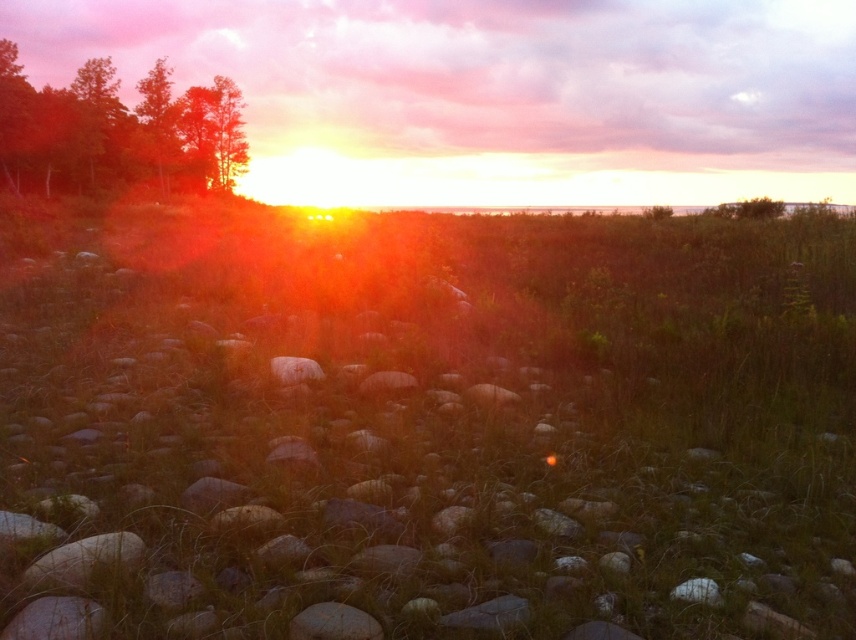
Question: Where is green grass at center located in relation to green matte trees at left in the image?

Choices:
 (A) right
 (B) left

Answer: (A)

Question: Among these objects, which one is nearest to the camera?

Choices:
 (A) green grass at center
 (B) green matte trees at left

Answer: (A)

Question: Does green grass at center lie in front of green matte trees at left?

Choices:
 (A) yes
 (B) no

Answer: (A)

Question: Can you confirm if green grass at center is thinner than green matte trees at left?

Choices:
 (A) no
 (B) yes

Answer: (A)

Question: Which point appears farthest from the camera in this image?

Choices:
 (A) (120, 234)
 (B) (233, 154)

Answer: (B)